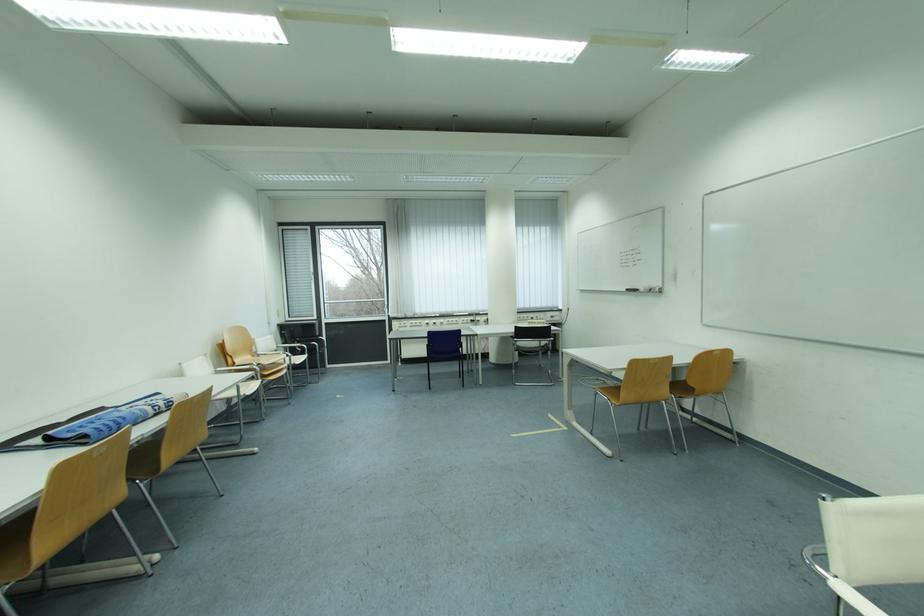
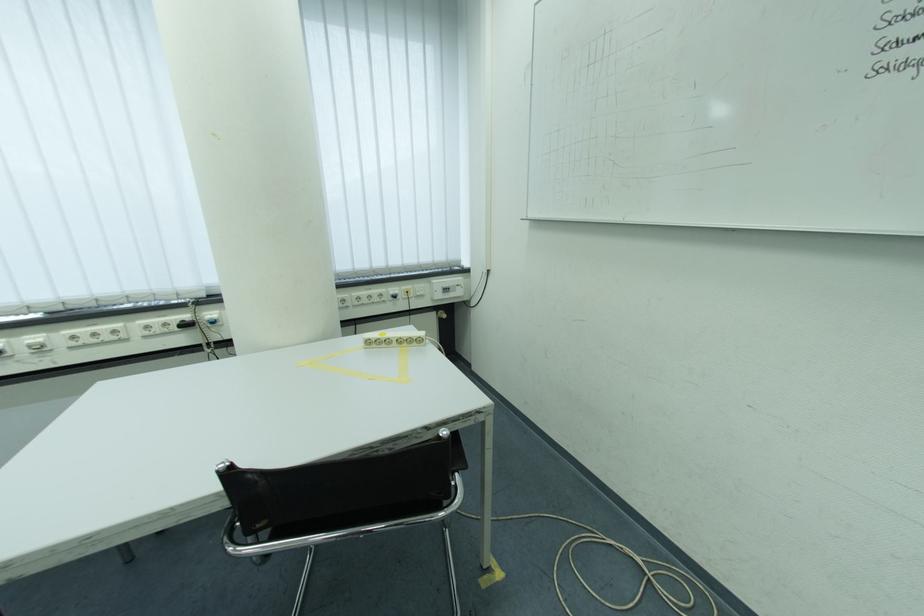
Locate, in the second image, the point that corresponds to pixel 487 321 in the first image.

(217, 315)